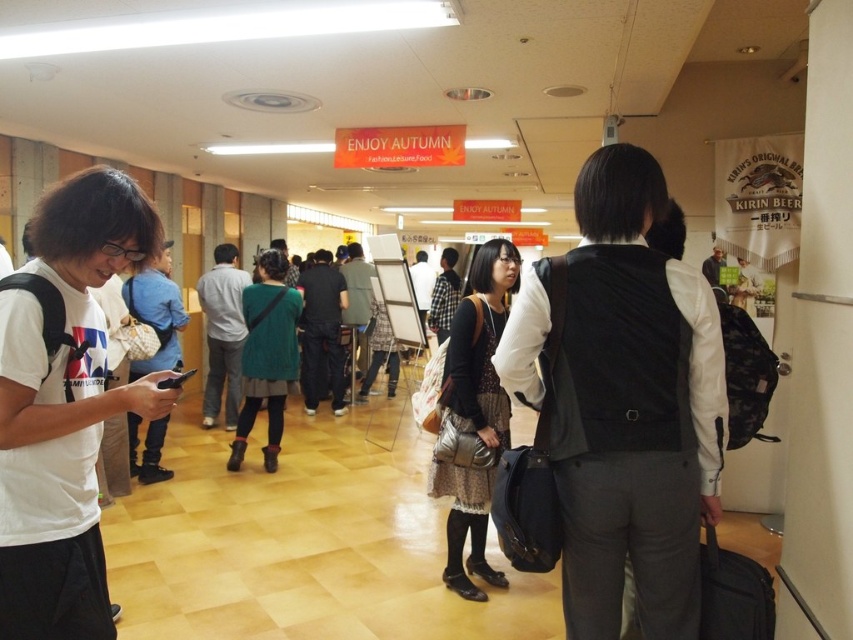
Can you confirm if black matte vest at center is taller than white matte t-shirt at left?

Yes, black matte vest at center is taller than white matte t-shirt at left.

Which of these two, black matte vest at center or white matte t-shirt at left, stands taller?

With more height is black matte vest at center.

The width and height of the screenshot is (853, 640). What do you see at coordinates (624, 403) in the screenshot?
I see `black matte vest at center` at bounding box center [624, 403].

Where is `black matte vest at center`? This screenshot has height=640, width=853. black matte vest at center is located at coordinates (624, 403).